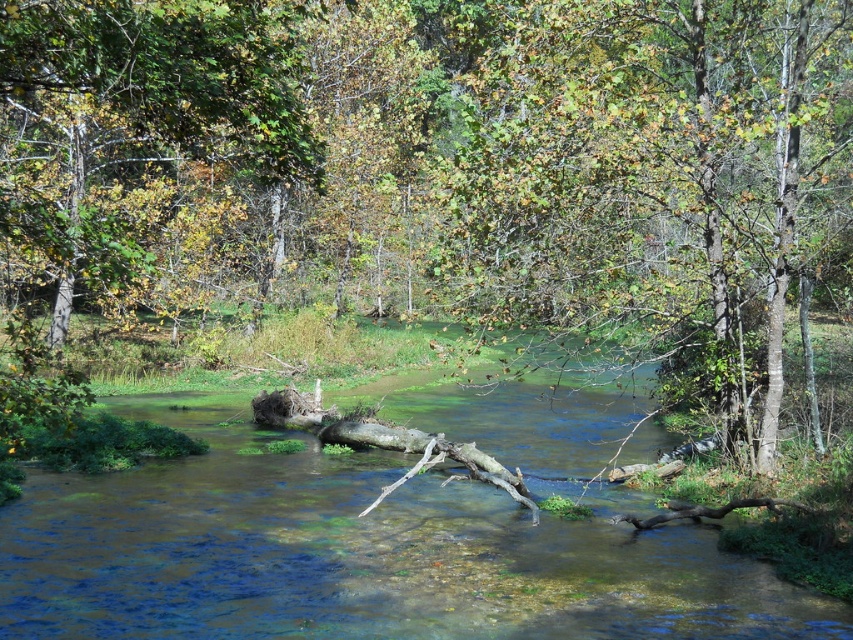
Which is behind, point (167, 413) or point (782, 244)?

The point (167, 413) is behind.

Who is lower down, clear water at center or green leafy tree at upper center?

clear water at center is below.

Is point (612, 547) closer to viewer compared to point (540, 116)?

Yes, it is.

This screenshot has width=853, height=640. In order to click on clear water at center in this screenshot , I will do pyautogui.click(x=357, y=554).